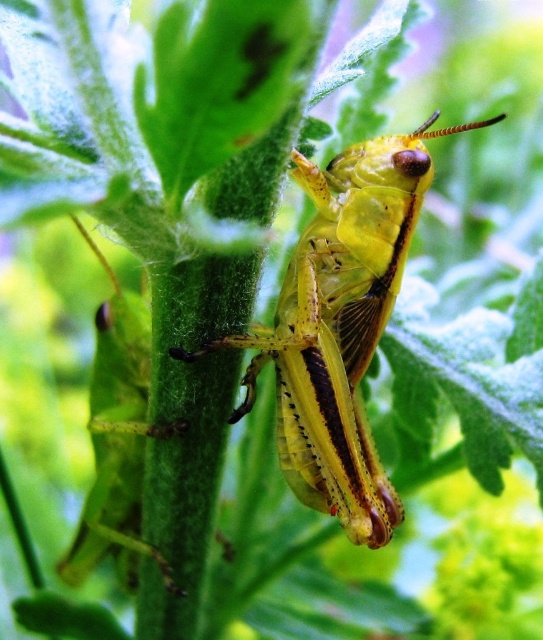
Question: Observing the image, what is the correct spatial positioning of yellow matte grasshopper at center in reference to green matte grasshopper at center?

Choices:
 (A) right
 (B) left

Answer: (A)

Question: Which of the following is the closest to the observer?

Choices:
 (A) (125, 371)
 (B) (306, 344)

Answer: (B)

Question: Which point is closer to the camera?

Choices:
 (A) (244, 381)
 (B) (104, 388)

Answer: (A)

Question: Does yellow matte grasshopper at center appear on the left side of green matte grasshopper at center?

Choices:
 (A) yes
 (B) no

Answer: (B)

Question: Does yellow matte grasshopper at center appear over green matte grasshopper at center?

Choices:
 (A) yes
 (B) no

Answer: (A)

Question: Which point is farther to the camera?

Choices:
 (A) green matte grasshopper at center
 (B) yellow matte grasshopper at center

Answer: (A)